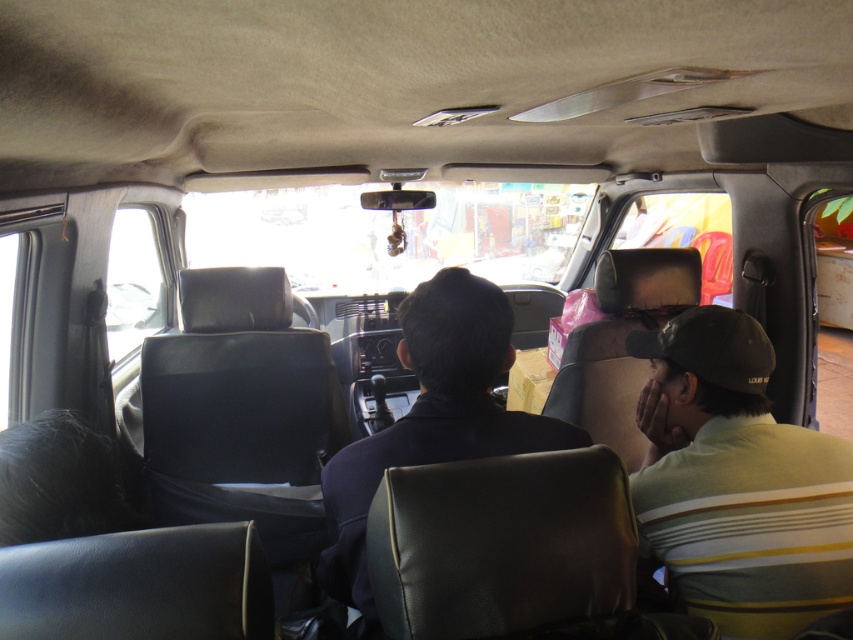
You are a passenger in the vehicle and need to hand a document to the person wearing the dark blue leather jacket at center. The green striped shirt at right is blocking your path. Which direction should you move to avoid them?

You should move to the left to avoid the green striped shirt at right, as it is positioned to the right of the dark blue leather jacket at center.

You are a passenger in the vehicle and need to move from your seat to the exit door located at the back. You see the green striped shirt at right and the dark blue leather jacket at center in your path. Which item takes up more space horizontally in the vehicle?

The dark blue leather jacket at center takes up more space horizontally compared to the green striped shirt at right since the green striped shirt at right has a lesser width.

You are a passenger in a vehicle and need to reach an item on the ceiling. You see a green striped shirt at right and a dark blue leather jacket at center. Which clothing item is closer to the ceiling?

The green striped shirt at right is shorter than the dark blue leather jacket at center, so the dark blue leather jacket at center is closer to the ceiling.